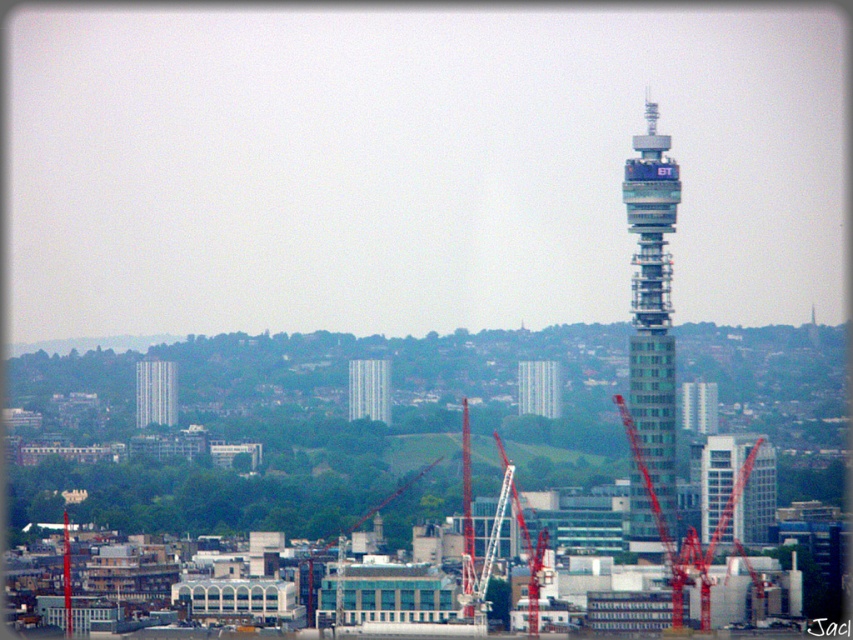
You are a drone operator planning to fly a drone from your current position to the point marked at coordinates point (636, 474). The drone has a maximum flight range of 600 meters. Based on the scene description, can the drone reach the point?

The point (636, 474) is 658.37 meters away from the camera, which exceeds the drone maximum flight range of 600 meters. Therefore, the drone cannot reach the point.

You are a drone operator planning to fly a drone from the silver metallic bt tower at right to a construction site located at the foreground. The drone has a maximum range of 2000 feet. Can the drone reach the construction site without needing to recharge?

The distance between the silver metallic bt tower at right and the construction site is 2143.27 feet, which exceeds the drone operator maximum range of 2000 feet. Therefore, the drone cannot reach the construction site without needing to recharge.

You are a city planner assessing the urban development in the area. Given the presence of the red metal crane at center and the gray concrete building at center, which object would you prioritize for safety inspections based on their size?

The red metal crane at center has a larger size compared to the gray concrete building at center, so safety inspections should prioritize the red metal crane at center due to its greater size and potential impact on surrounding areas.